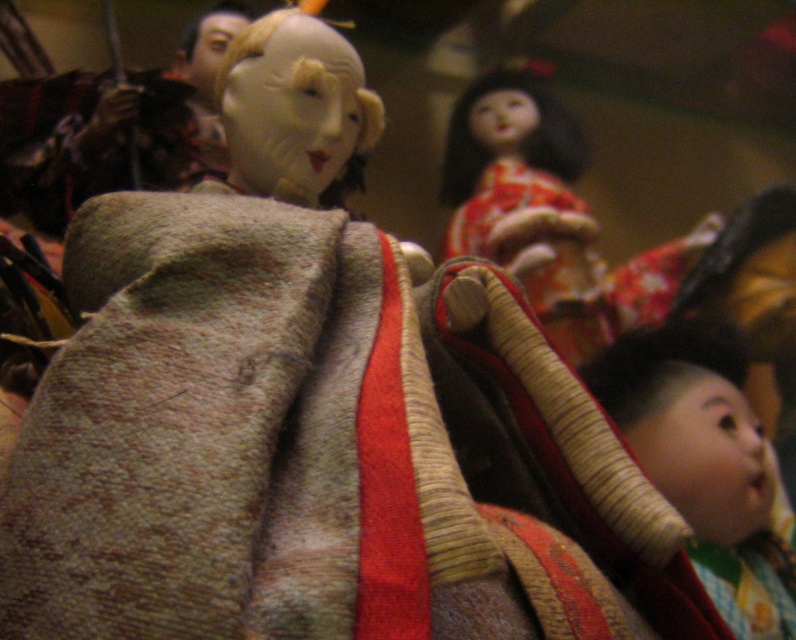
What do you see at coordinates (704, 461) in the screenshot? I see `smooth beige headband at lower right` at bounding box center [704, 461].

Between smooth beige headband at lower right and matte orange kimono at upper center, which one appears on the left side from the viewer's perspective?

matte orange kimono at upper center is more to the left.

Is point (592, 378) more distant than point (564, 228)?

No, it is not.

This screenshot has height=640, width=796. What are the coordinates of `smooth beige headband at lower right` in the screenshot? It's located at (704, 461).